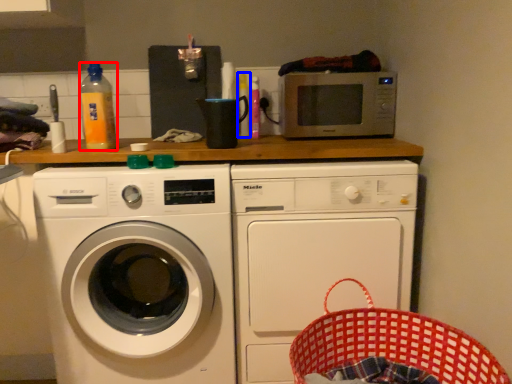
Question: Which object is closer to the camera taking this photo, bottle (highlighted by a red box) or bottle (highlighted by a blue box)?

Choices:
 (A) bottle
 (B) bottle

Answer: (A)